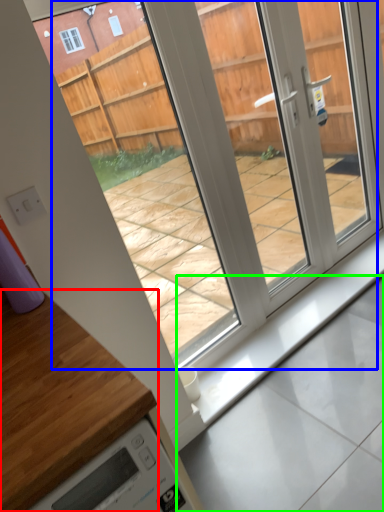
Question: Considering the real-world distances, which object is closest to countertop (highlighted by a red box)? glass door (highlighted by a blue box) or concrete (highlighted by a green box).

Choices:
 (A) glass door
 (B) concrete

Answer: (B)